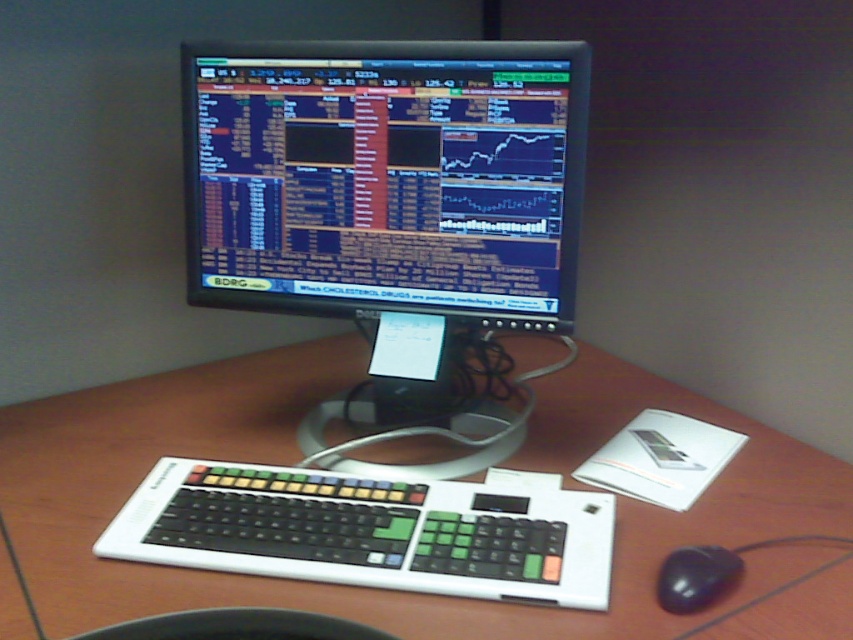
Does brown wood table at center have a lesser width compared to black rubber mouse at lower right?

No, brown wood table at center is not thinner than black rubber mouse at lower right.

Who is positioned more to the right, brown wood table at center or black rubber mouse at lower right?

black rubber mouse at lower right

Who is more forward, (631, 568) or (715, 554)?

Point (715, 554)

Find the location of `brown wood table at center`. brown wood table at center is located at coordinates (299, 456).

Can you confirm if black glossy monitor at center is taller than black plastic keyboard at lower center?

Indeed, black glossy monitor at center has a greater height compared to black plastic keyboard at lower center.

What do you see at coordinates (393, 216) in the screenshot? The image size is (853, 640). I see `black glossy monitor at center` at bounding box center [393, 216].

Is point (482, 236) positioned before point (550, 532)?

No, (482, 236) is further to viewer.

This screenshot has height=640, width=853. I want to click on black glossy monitor at center, so click(393, 216).

Which is behind, point (302, 372) or point (204, 612)?

Positioned behind is point (302, 372).

Is point (343, 604) positioned behind point (200, 611)?

That is True.

Where is `brown wood table at center`? The height and width of the screenshot is (640, 853). brown wood table at center is located at coordinates (299, 456).